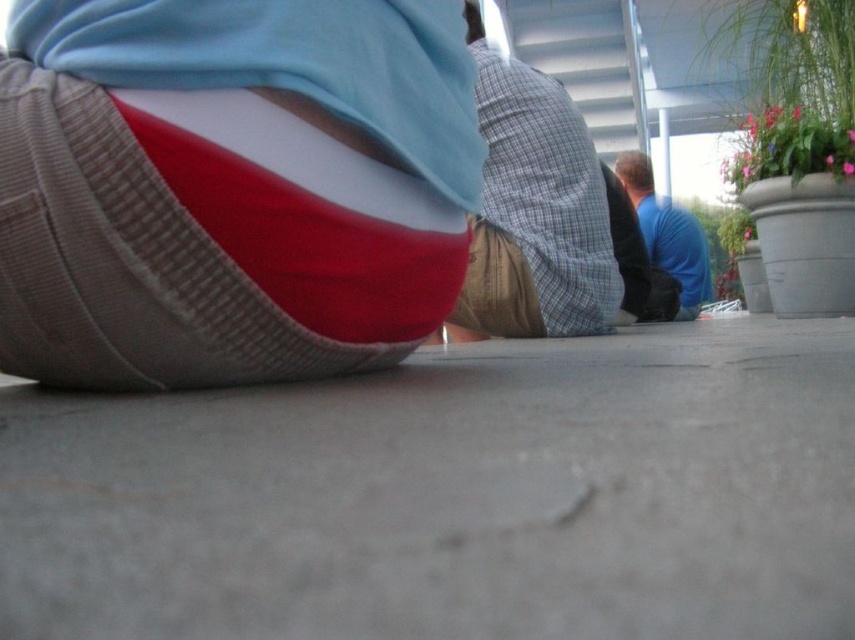
Is knitted fabric pants at lower left in front of blue cotton shirt at upper right?

Yes, it is in front of blue cotton shirt at upper right.

From the picture: Is knitted fabric pants at lower left wider than blue cotton shirt at upper right?

In fact, knitted fabric pants at lower left might be narrower than blue cotton shirt at upper right.

Who is more forward, [429,214] or [690,266]?

Point [429,214] is more forward.

Identify the location of knitted fabric pants at lower left. (230, 186).

Is gray concrete pavement at lower center to the left of blue cotton shirt at upper right from the viewer's perspective?

Yes, gray concrete pavement at lower center is to the left of blue cotton shirt at upper right.

Does point (759, 605) come in front of point (647, 212)?

That is True.

Locate an element on the screen. The height and width of the screenshot is (640, 855). gray concrete pavement at lower center is located at coordinates (451, 497).

Is gray concrete pavement at lower center below plaid fabric shirt at center?

Correct, gray concrete pavement at lower center is located below plaid fabric shirt at center.

Locate an element on the screen. Image resolution: width=855 pixels, height=640 pixels. gray concrete pavement at lower center is located at coordinates (451, 497).

You are a GUI agent. You are given a task and a screenshot of the screen. Output one action in this format:
    pyautogui.click(x=<x>, y=<y>)
    Task: Click on the gray concrete pavement at lower center
    This screenshot has height=640, width=855.
    Given the screenshot: What is the action you would take?
    pyautogui.click(x=451, y=497)

Where is `gray concrete pavement at lower center`? gray concrete pavement at lower center is located at coordinates (451, 497).